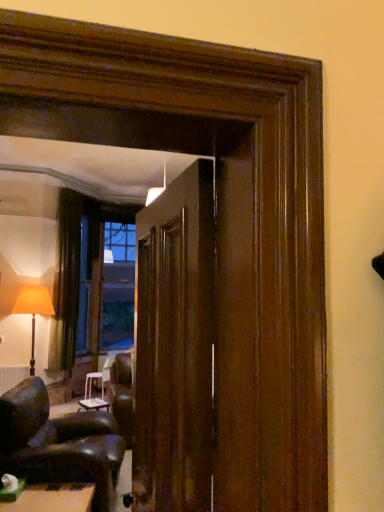
The height and width of the screenshot is (512, 384). What are the coordinates of `white glossy table at lower center, placed as the third table when sorted from bottom to top` in the screenshot? It's located at (93, 404).

At what (x,y) coordinates should I click in order to perform the action: click on white plastic stool at center, the 1th table positioned from the bottom. Please return your answer as a coordinate pair (x, y). The height and width of the screenshot is (512, 384). Looking at the image, I should click on (91, 384).

Based on the photo, from a real-world perspective, is white plastic stool at center, the 1th table in the back-to-front sequence, positioned under white matte radiator at lower left based on gravity?

Yes, from a real-world perspective, white plastic stool at center, the 1th table in the back-to-front sequence, is below white matte radiator at lower left.

Is white plastic stool at center, marked as the third table in a top-to-bottom arrangement, surrounding white matte radiator at lower left?

No, white matte radiator at lower left is located outside of white plastic stool at center, marked as the third table in a top-to-bottom arrangement.

Which of these two, white plastic stool at center, the 1th table positioned from the bottom, or white matte radiator at lower left, stands taller?

Standing taller between the two is white matte radiator at lower left.

Is there a large distance between white plastic stool at center, the 1th table in the back-to-front sequence, and white matte radiator at lower left?

They are positioned close to each other.

Locate an element on the screen. door lying on the right of matte orange fabric lampshade at left is located at coordinates (175, 346).

Does matte orange fabric lampshade at left turn towards glossy wood door at center?

Yes, matte orange fabric lampshade at left is oriented towards glossy wood door at center.

Considering the sizes of matte orange fabric lampshade at left and glossy wood door at center in the image, is matte orange fabric lampshade at left taller or shorter than glossy wood door at center?

In the image, matte orange fabric lampshade at left appears to be taller than glossy wood door at center.

From the image's perspective, would you say matte orange fabric lampshade at left is shown under glossy wood door at center?

Correct, matte orange fabric lampshade at left appears lower than glossy wood door at center in the image.

Would you say white plastic stool at center, the 1th table in the back-to-front sequence, is inside or outside white glossy table at lower center, placed as the third table when sorted from bottom to top?

white plastic stool at center, the 1th table in the back-to-front sequence, exists outside the volume of white glossy table at lower center, placed as the third table when sorted from bottom to top.

Is white plastic stool at center, the 1th table positioned from the bottom, bigger or smaller than white glossy table at lower center, which ranks as the second table in front-to-back order?

white plastic stool at center, the 1th table positioned from the bottom, is bigger than white glossy table at lower center, which ranks as the second table in front-to-back order.

Which object is wider, white plastic stool at center, marked as the third table in a top-to-bottom arrangement, or white glossy table at lower center, positioned as the first table in top-to-bottom order?

With larger width is white plastic stool at center, marked as the third table in a top-to-bottom arrangement.

Which is less distant, [28,446] or [6,379]?

The point [28,446] is closer to the camera.

Can you confirm if leather armchair at lower left is taller than white matte radiator at lower left?

Indeed, leather armchair at lower left has a greater height compared to white matte radiator at lower left.

I want to click on chair that appears on the right of white matte radiator at lower left, so click(x=58, y=443).

Is leather armchair at lower left completely or partially outside of white matte radiator at lower left?

That's correct, leather armchair at lower left is outside of white matte radiator at lower left.

Can you confirm if white plastic stool at center, the 1th table positioned from the bottom, is shorter than leather armchair at lower left?

Yes.

Measure the distance between white plastic stool at center, marked as the third table in a top-to-bottom arrangement, and leather armchair at lower left.

They are 34.64 inches apart.

Considering the positions of points (86, 375) and (102, 453), is point (86, 375) closer to camera compared to point (102, 453)?

No, it is not.

Is white plastic stool at center, marked as the third table in a top-to-bottom arrangement, in contact with leather armchair at lower left?

white plastic stool at center, marked as the third table in a top-to-bottom arrangement, is not next to leather armchair at lower left, and they're not touching.

Could you tell me if glossy wood door at center is facing white glossy table at lower center, arranged as the 2th table when viewed from the back?

No, glossy wood door at center is not turned towards white glossy table at lower center, arranged as the 2th table when viewed from the back.

Is glossy wood door at center spatially inside white glossy table at lower center, arranged as the 2th table when viewed from the back, or outside of it?

glossy wood door at center is not enclosed by white glossy table at lower center, arranged as the 2th table when viewed from the back.

From a real-world perspective, is glossy wood door at center physically located above or below white glossy table at lower center, which ranks as the second table in front-to-back order?

From a real-world perspective, glossy wood door at center is physically above white glossy table at lower center, which ranks as the second table in front-to-back order.

Is glossy wood door at center far away from white glossy table at lower center, which ranks as the second table in front-to-back order?

That's right, there is a large distance between glossy wood door at center and white glossy table at lower center, which ranks as the second table in front-to-back order.

From the image's perspective, is green felt table at lower left, acting as the 3th table starting from the back, over white glossy table at lower center, which ranks as the second table in front-to-back order?

No, from the image's perspective, green felt table at lower left, acting as the 3th table starting from the back, is not on top of white glossy table at lower center, which ranks as the second table in front-to-back order.

Are green felt table at lower left, the 2th table when ordered from bottom to top, and white glossy table at lower center, arranged as the 2th table when viewed from the back, beside each other?

No, green felt table at lower left, the 2th table when ordered from bottom to top, is not next to white glossy table at lower center, arranged as the 2th table when viewed from the back.

Who is shorter, green felt table at lower left, the 2th table when ordered from bottom to top, or white glossy table at lower center, positioned as the first table in top-to-bottom order?

With less height is white glossy table at lower center, positioned as the first table in top-to-bottom order.

From a real-world perspective, who is located higher, green felt table at lower left, acting as the 3th table starting from the back, or white glossy table at lower center, positioned as the first table in top-to-bottom order?

white glossy table at lower center, positioned as the first table in top-to-bottom order.

The height and width of the screenshot is (512, 384). In order to click on table behind the white matte radiator at lower left in this screenshot , I will do `click(91, 384)`.

At what (x,y) coordinates should I click in order to perform the action: click on table lamp on the left of glossy wood door at center. Please return your answer as a coordinate pair (x, y). This screenshot has width=384, height=512. Looking at the image, I should click on (33, 310).

When comparing their distances from green felt table at lower left, which is the second table from top to bottom, does white matte radiator at lower left or white glossy table at lower center, placed as the third table when sorted from bottom to top, seem closer?

Among the two, white glossy table at lower center, placed as the third table when sorted from bottom to top, is located nearer to green felt table at lower left, which is the second table from top to bottom.

Based on the photo, looking at the image, which one is located closer to white plastic stool at center, marked as the third table in a top-to-bottom arrangement, matte orange fabric lampshade at left or glossy wood door at center?

Among the two, matte orange fabric lampshade at left is located nearer to white plastic stool at center, marked as the third table in a top-to-bottom arrangement.

Looking at the image, which one is located further to dark brown fabric curtain at left, green felt table at lower left, the 2th table when ordered from bottom to top, or white plastic stool at center, the 1th table positioned from the bottom?

green felt table at lower left, the 2th table when ordered from bottom to top.

From the image, which object appears to be nearer to white plastic stool at center, the 1th table positioned from the bottom, dark brown fabric curtain at left or white matte radiator at lower left?

white matte radiator at lower left is positioned closer to the anchor white plastic stool at center, the 1th table positioned from the bottom.

Looking at the image, which one is located further to white plastic stool at center, the 1th table in the back-to-front sequence, leather armchair at lower left or green felt table at lower left, the 2th table when ordered from bottom to top?

green felt table at lower left, the 2th table when ordered from bottom to top, is further to white plastic stool at center, the 1th table in the back-to-front sequence.

Looking at the image, which one is located further to white plastic stool at center, the 1th table positioned from the bottom, white glossy table at lower center, positioned as the first table in top-to-bottom order, or glossy wood door at center?

glossy wood door at center is further to white plastic stool at center, the 1th table positioned from the bottom.

Looking at the image, which one is located closer to leather armchair at lower left, dark brown fabric curtain at left or white glossy table at lower center, placed as the third table when sorted from bottom to top?

white glossy table at lower center, placed as the third table when sorted from bottom to top, is closer to leather armchair at lower left.

Looking at the image, which one is located further to white glossy table at lower center, which ranks as the second table in front-to-back order, matte orange fabric lampshade at left or glossy wood door at center?

Based on the image, glossy wood door at center appears to be further to white glossy table at lower center, which ranks as the second table in front-to-back order.

What are the coordinates of `table lamp between glossy wood door at center and white plastic stool at center, the 1th table in the back-to-front sequence, along the z-axis` in the screenshot? It's located at (33, 310).

Where is `curtain between leather armchair at lower left and white plastic stool at center, marked as the third table in a top-to-bottom arrangement, from front to back`? The width and height of the screenshot is (384, 512). curtain between leather armchair at lower left and white plastic stool at center, marked as the third table in a top-to-bottom arrangement, from front to back is located at coordinates (67, 282).

In order to click on table located between green felt table at lower left, the 2th table when ordered from bottom to top, and white plastic stool at center, marked as the third table in a top-to-bottom arrangement, in the depth direction in this screenshot , I will do `click(93, 404)`.

Where is `curtain between green felt table at lower left, the 2th table when ordered from bottom to top, and white plastic stool at center, the 1th table positioned from the bottom, from front to back`? The image size is (384, 512). curtain between green felt table at lower left, the 2th table when ordered from bottom to top, and white plastic stool at center, the 1th table positioned from the bottom, from front to back is located at coordinates (67, 282).